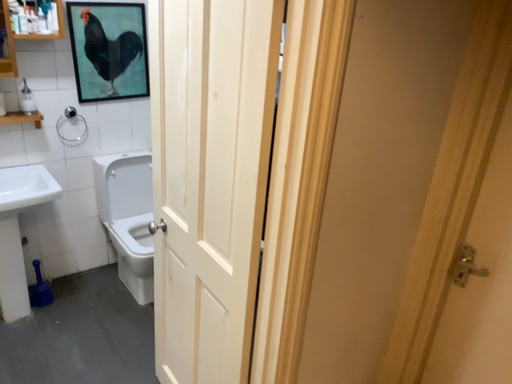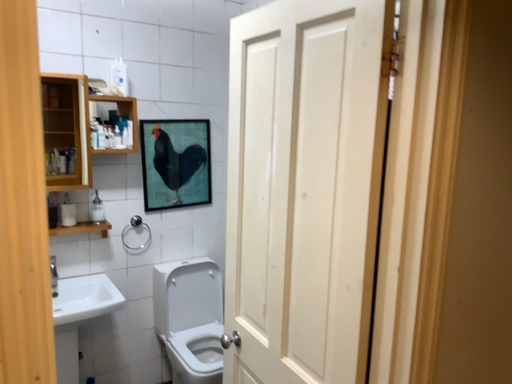
Question: How did the camera likely rotate when shooting the video?

Choices:
 (A) rotated upward
 (B) rotated downward

Answer: (A)